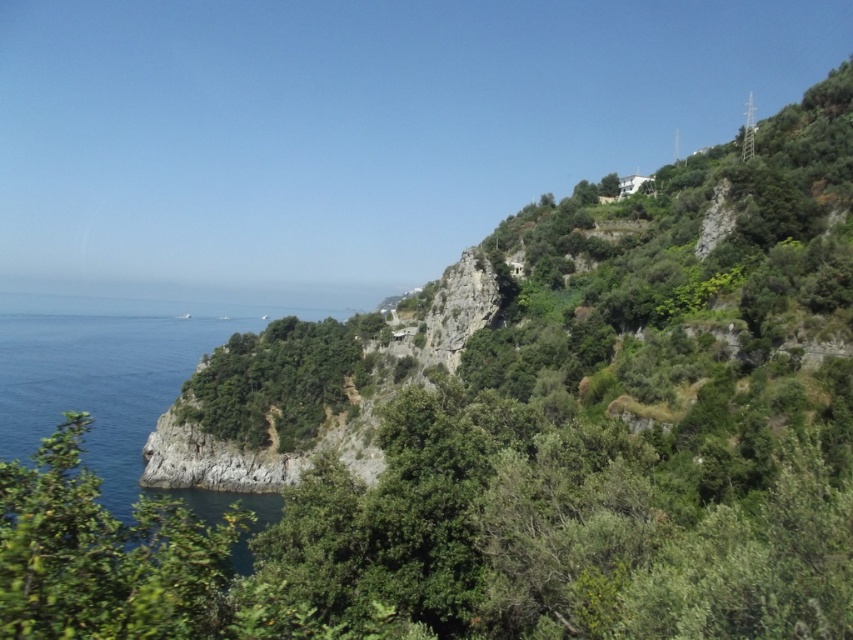
Is point (90, 342) positioned before point (283, 355)?

No.

Does point (248, 508) come in front of point (259, 356)?

Yes, point (248, 508) is closer to viewer.

I want to click on blue water at lower left, so click(x=99, y=384).